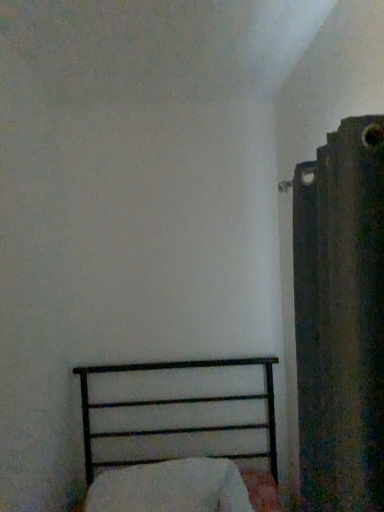
What do you see at coordinates (179, 403) in the screenshot? I see `black metal bed at lower left` at bounding box center [179, 403].

This screenshot has width=384, height=512. I want to click on black metal bed at lower left, so click(x=179, y=403).

Can you tell me how much white soft pillow at lower center and black metal bed at lower left differ in facing direction?

The angular difference between white soft pillow at lower center and black metal bed at lower left is 3.65 degrees.

Does white soft pillow at lower center have a greater width compared to black metal bed at lower left?

No.

Considering the sizes of white soft pillow at lower center and black metal bed at lower left in the image, is white soft pillow at lower center taller or shorter than black metal bed at lower left?

Clearly, white soft pillow at lower center is shorter compared to black metal bed at lower left.

Which is behind, point (111, 483) or point (277, 477)?

The point (277, 477) is farther.

From the picture: Which is less distant, (293, 244) or (116, 494)?

Point (293, 244) is positioned farther from the camera compared to point (116, 494).

Considering the relative sizes of dark textured fabric at right and white soft pillow at lower center in the image provided, is dark textured fabric at right taller than white soft pillow at lower center?

Correct, dark textured fabric at right is much taller as white soft pillow at lower center.

In the scene shown: Is white soft pillow at lower center surrounded by dark textured fabric at right?

That's incorrect, white soft pillow at lower center is not inside dark textured fabric at right.

From the image's perspective, would you say dark textured fabric at right is shown under white soft pillow at lower center?

No, from the image's perspective, dark textured fabric at right is not below white soft pillow at lower center.

At what (x,y) coordinates should I click in order to perform the action: click on bed that appears below the dark textured fabric at right (from a real-world perspective). Please return your answer as a coordinate pair (x, y). Image resolution: width=384 pixels, height=512 pixels. Looking at the image, I should click on (x=179, y=403).

Considering the points (313, 181) and (268, 383), which point is behind, point (313, 181) or point (268, 383)?

Positioned behind is point (268, 383).

Find the location of `bed located on the left of dark textured fabric at right`. bed located on the left of dark textured fabric at right is located at coordinates click(x=179, y=403).

In the image, is black metal bed at lower left positioned in front of or behind dark textured fabric at right?

black metal bed at lower left is behind dark textured fabric at right.

From the image's perspective, which object appears higher, black metal bed at lower left or dark textured fabric at right?

From the image's view, dark textured fabric at right is above.

In the scene shown: Can we say white soft pillow at lower center lies outside dark textured fabric at right?

Yes, white soft pillow at lower center is outside of dark textured fabric at right.

Does point (192, 493) come closer to viewer compared to point (326, 423)?

No, it is behind (326, 423).

Which is more to the left, white soft pillow at lower center or dark textured fabric at right?

white soft pillow at lower center.

Is white soft pillow at lower center positioned in front of dark textured fabric at right?

No.

Does black metal bed at lower left turn towards white soft pillow at lower center?

Yes.

The height and width of the screenshot is (512, 384). What are the coordinates of `pillow located below the black metal bed at lower left (from the image's perspective)` in the screenshot? It's located at (171, 488).

How many degrees apart are the facing directions of black metal bed at lower left and white soft pillow at lower center?

The facing directions of black metal bed at lower left and white soft pillow at lower center are 3.65 degrees apart.

Between black metal bed at lower left and white soft pillow at lower center, which one has smaller width?

white soft pillow at lower center is thinner.

At what (x,y) coordinates should I click in order to perform the action: click on pillow below the black metal bed at lower left (from a real-world perspective). Please return your answer as a coordinate pair (x, y). The width and height of the screenshot is (384, 512). Looking at the image, I should click on (171, 488).

The height and width of the screenshot is (512, 384). Identify the location of pillow that appears below the dark textured fabric at right (from the image's perspective). (171, 488).

From the image, which object appears to be nearer to white soft pillow at lower center, dark textured fabric at right or black metal bed at lower left?

black metal bed at lower left is closer to white soft pillow at lower center.

Estimate the real-world distances between objects in this image. Which object is further from black metal bed at lower left, dark textured fabric at right or white soft pillow at lower center?

Based on the image, dark textured fabric at right appears to be further to black metal bed at lower left.

Based on their spatial positions, is white soft pillow at lower center or black metal bed at lower left further from dark textured fabric at right?

black metal bed at lower left is positioned further to the anchor dark textured fabric at right.

Based on their spatial positions, is black metal bed at lower left or white soft pillow at lower center closer to dark textured fabric at right?

Among the two, white soft pillow at lower center is located nearer to dark textured fabric at right.

When comparing their distances from black metal bed at lower left, does white soft pillow at lower center or dark textured fabric at right seem further?

dark textured fabric at right is further to black metal bed at lower left.

Which object lies further to the anchor point white soft pillow at lower center, black metal bed at lower left or dark textured fabric at right?

dark textured fabric at right is positioned further to the anchor white soft pillow at lower center.

This screenshot has width=384, height=512. I want to click on bed that lies between dark textured fabric at right and white soft pillow at lower center from top to bottom, so click(179, 403).